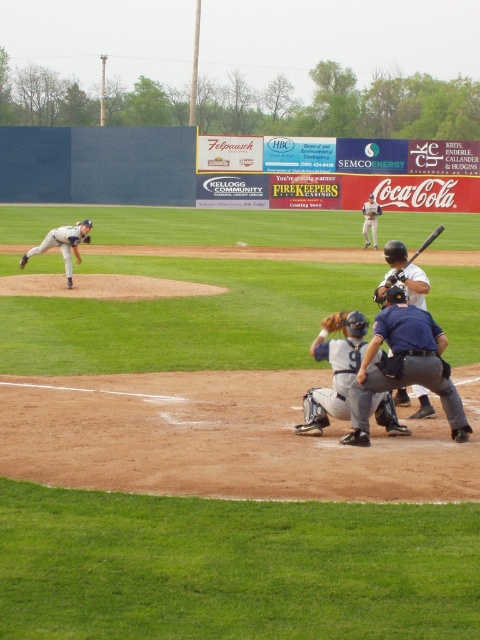
Which is below, blue padded umpire at center or white uniformed pitcher at left?

blue padded umpire at center

Can you confirm if blue padded umpire at center is wider than white uniformed pitcher at left?

Incorrect, blue padded umpire at center's width does not surpass white uniformed pitcher at left's.

Is point (357, 376) farther from viewer compared to point (26, 252)?

No, (357, 376) is in front of (26, 252).

This screenshot has height=640, width=480. I want to click on blue padded umpire at center, so click(404, 365).

Which is more to the right, white matte bat at center or brown leather glove at lower center?

From the viewer's perspective, white matte bat at center appears more on the right side.

Between white matte bat at center and brown leather glove at lower center, which one has more height?

Standing taller between the two is white matte bat at center.

Does point (420, 305) lie in front of point (326, 321)?

No, it is not.

Where is `white matte bat at center`? This screenshot has width=480, height=640. white matte bat at center is located at coordinates (403, 275).

Who is more forward, (382, 285) or (362, 209)?

Point (382, 285) is more forward.

Does white matte bat at center appear on the right side of white uniform at center?

Incorrect, white matte bat at center is not on the right side of white uniform at center.

At what (x,y) coordinates should I click in order to perform the action: click on white matte bat at center. Please return your answer as a coordinate pair (x, y). Looking at the image, I should click on (403, 275).